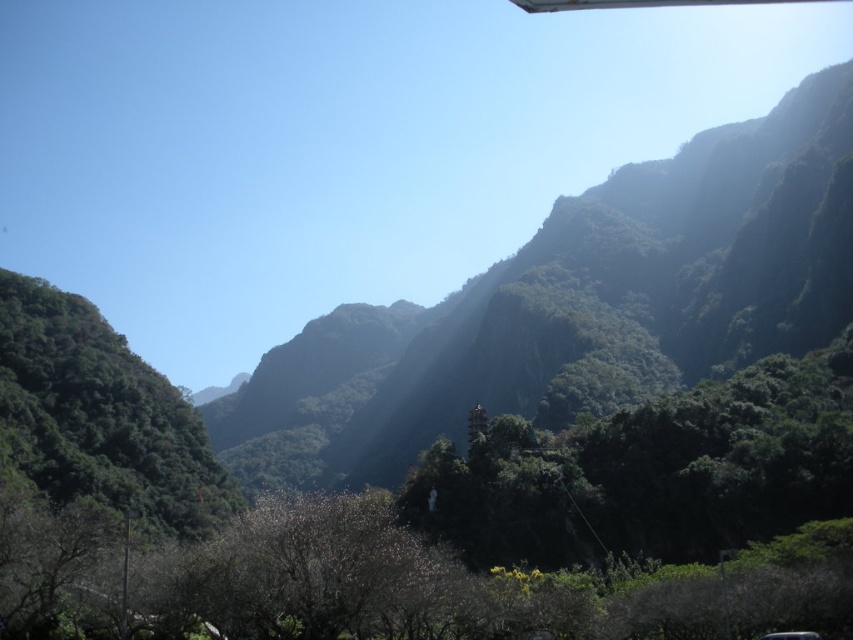
Question: Among these objects, which one is nearest to the camera?

Choices:
 (A) green matte tree at center
 (B) green leafy tree at left

Answer: (B)

Question: Can you confirm if green matte tree at center is thinner than green leafy tree at left?

Choices:
 (A) no
 (B) yes

Answer: (B)

Question: From the image, what is the correct spatial relationship of green matte tree at center in relation to green leafy tree at left?

Choices:
 (A) below
 (B) above

Answer: (B)

Question: Can you confirm if green matte tree at center is positioned above green leafy tree at left?

Choices:
 (A) no
 (B) yes

Answer: (B)